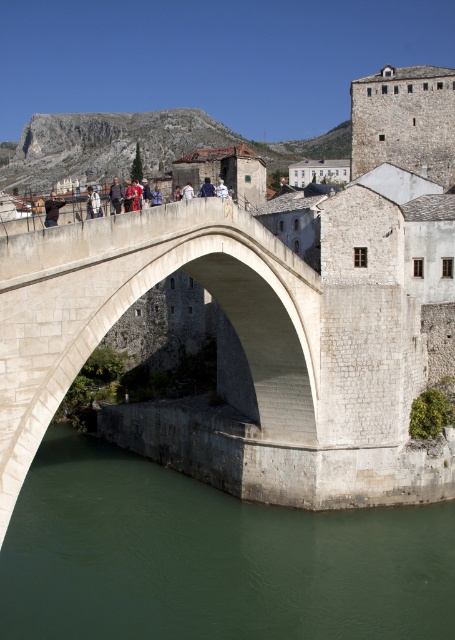
Consider the image. Which is more to the left, green stone water at lower center or dark blue jeans at center?

dark blue jeans at center

Is the position of green stone water at lower center less distant than that of dark blue jeans at center?

Yes, green stone water at lower center is closer to the viewer.

Locate an element on the screen. This screenshot has width=455, height=640. green stone water at lower center is located at coordinates (210, 557).

Consider the image. Can you confirm if light brown leather jacket at center is positioned below dark blue jeans at center?

Correct, light brown leather jacket at center is located below dark blue jeans at center.

Between point (91, 216) and point (120, 196), which one is positioned in front?

Point (91, 216) is more forward.

Find the location of a particular element. light brown leather jacket at center is located at coordinates (92, 204).

Can you confirm if white stone arch bridge at center is positioned below light brown leather jacket at center?

Yes.

This screenshot has height=640, width=455. In order to click on white stone arch bridge at center in this screenshot , I will do `click(135, 300)`.

Does point (257, 310) lie behind point (87, 218)?

That is True.

Find the location of a particular element. white stone arch bridge at center is located at coordinates (135, 300).